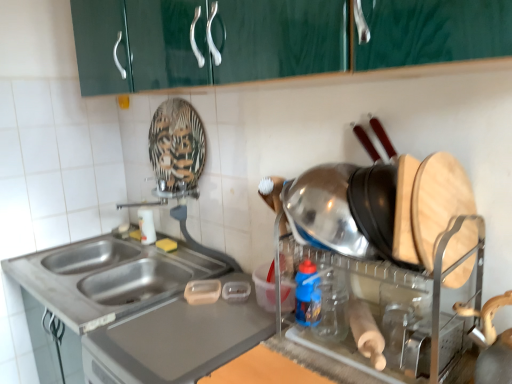
Question: Can you confirm if shiny metallic pot at right is taller than blue plastic bottle at center, the first bottle positioned from the front?

Choices:
 (A) no
 (B) yes

Answer: (B)

Question: Can you confirm if shiny metallic pot at right is wider than blue plastic bottle at center, the second bottle in the left-to-right sequence?

Choices:
 (A) no
 (B) yes

Answer: (B)

Question: Considering the relative sizes of shiny metallic pot at right and blue plastic bottle at center, the first bottle positioned from the front, in the image provided, is shiny metallic pot at right thinner than blue plastic bottle at center, the first bottle positioned from the front,?

Choices:
 (A) no
 (B) yes

Answer: (A)

Question: Is shiny metallic pot at right positioned in front of blue plastic bottle at center, placed as the first bottle when sorted from right to left?

Choices:
 (A) no
 (B) yes

Answer: (B)

Question: Is shiny metallic pot at right not near blue plastic bottle at center, the first bottle positioned from the front?

Choices:
 (A) no
 (B) yes

Answer: (A)

Question: Looking at the image, does blue plastic bottle at center, the first bottle positioned from the front, seem bigger or smaller compared to shiny metallic pot at right?

Choices:
 (A) small
 (B) big

Answer: (A)

Question: Looking at their shapes, would you say blue plastic bottle at center, positioned as the 2th bottle in back-to-front order, is wider or thinner than shiny metallic pot at right?

Choices:
 (A) wide
 (B) thin

Answer: (B)

Question: In the image, is blue plastic bottle at center, the first bottle positioned from the front, on the left side or the right side of shiny metallic pot at right?

Choices:
 (A) right
 (B) left

Answer: (B)

Question: Does point (309, 289) appear closer or farther from the camera than point (415, 380)?

Choices:
 (A) farther
 (B) closer

Answer: (A)

Question: From a real-world perspective, relative to stainless steel sink at lower left, is blue plastic bottle at center, the first bottle positioned from the front, vertically above or below?

Choices:
 (A) below
 (B) above

Answer: (B)

Question: Is blue plastic bottle at center, the first bottle positioned from the front, wider or thinner than stainless steel sink at lower left?

Choices:
 (A) thin
 (B) wide

Answer: (A)

Question: Do you think blue plastic bottle at center, the second bottle in the left-to-right sequence, is within stainless steel sink at lower left, or outside of it?

Choices:
 (A) inside
 (B) outside

Answer: (B)

Question: Considering the positions of point (298, 309) and point (140, 283), is point (298, 309) closer or farther from the camera than point (140, 283)?

Choices:
 (A) farther
 (B) closer

Answer: (B)

Question: From a real-world perspective, is white glossy bottle at sink, acting as the 1th bottle starting from the left, above or below stainless steel sink at lower left?

Choices:
 (A) above
 (B) below

Answer: (A)

Question: From the image's perspective, is white glossy bottle at sink, which appears as the first bottle when viewed from the back, above or below stainless steel sink at lower left?

Choices:
 (A) below
 (B) above

Answer: (B)